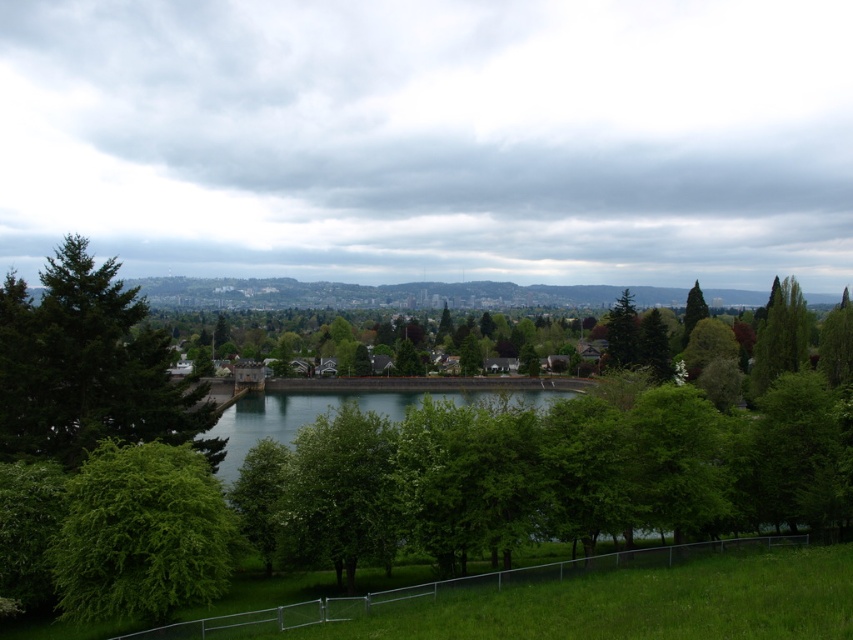
You are planning to plant a new tree in the park. You have two options for locations based on the image. The first location is next to the green matte tree at left, and the second is next to the green matte tree at upper right. Considering the space available, which location would allow for a larger tree to grow without overcrowding?

The green matte tree at upper right has a greater width than the green matte tree at left, so planting next to the green matte tree at upper right would provide more space for a larger tree to grow without overcrowding.

You are planning to plant a new tree in the park. You have two options from the image provided. Which tree, the green matte tree at left or the green matte tree at upper right, would require more space in the park?

The green matte tree at upper right would require more space because it occupies more space than the green matte tree at left according to the description.